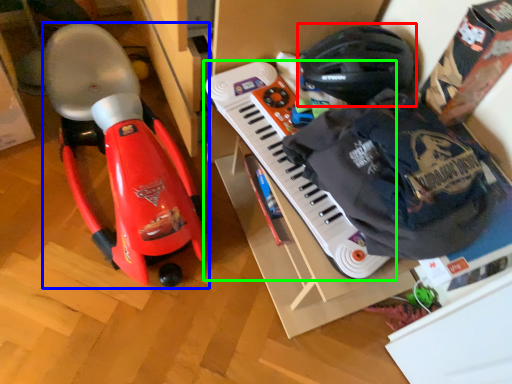
Question: Based on their relative distances, which object is farther from helmet (highlighted by a red box)? Choose from toy (highlighted by a blue box) and musical keyboard (highlighted by a green box).

Choices:
 (A) toy
 (B) musical keyboard

Answer: (A)